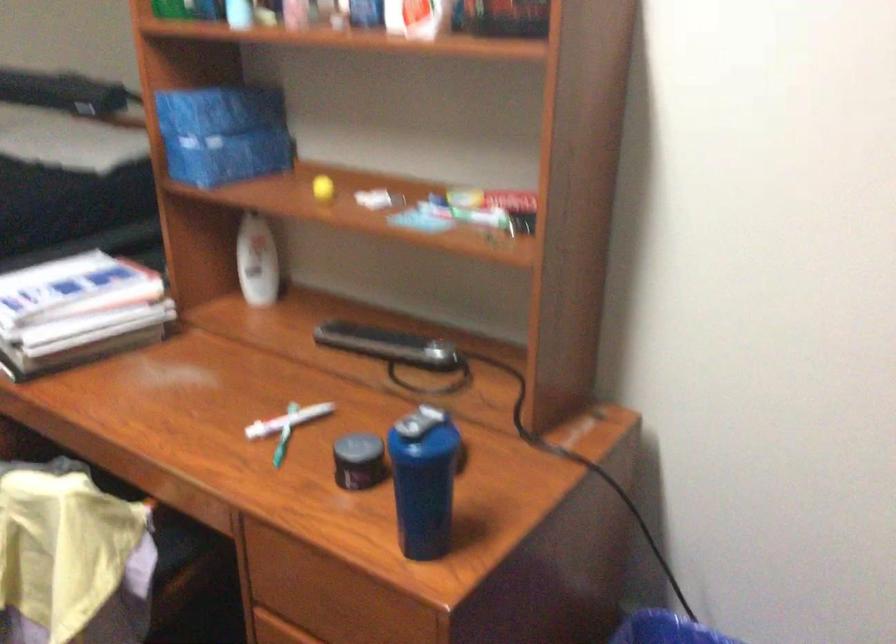
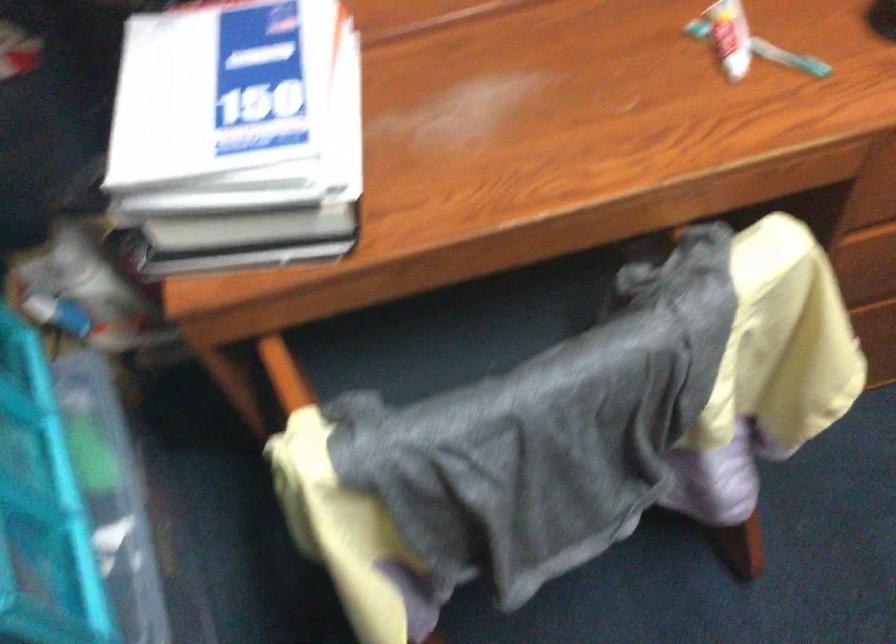
Where in the second image is the point corresponding to the point at 280,422 from the first image?

(730, 37)